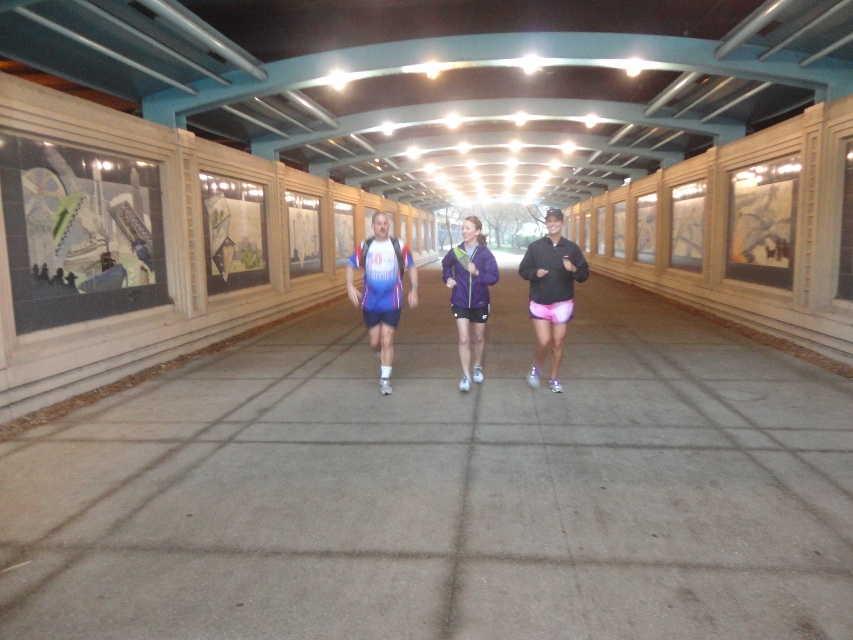
You are a photographer standing at the end of the walkway. You want to capture a photo of both the matte blue and white running shirt at center and the purple matte jacket at center without any obstructions. Which jogger should you focus on first to ensure both are visible in the frame?

You should focus on the matte blue and white running shirt at center first because the purple matte jacket at center is behind it. By focusing on the front jogger, both will be visible in the frame.

You are a photographer positioned at the end of the covered walkway. You want to capture both the matte blue and white running shirt at center and the purple matte jacket at center in a single shot. Which object should you focus on first to ensure both are in frame?

The matte blue and white running shirt at center has a lesser height compared to the purple matte jacket at center, so you should focus on the purple matte jacket at center first to ensure both are in frame.